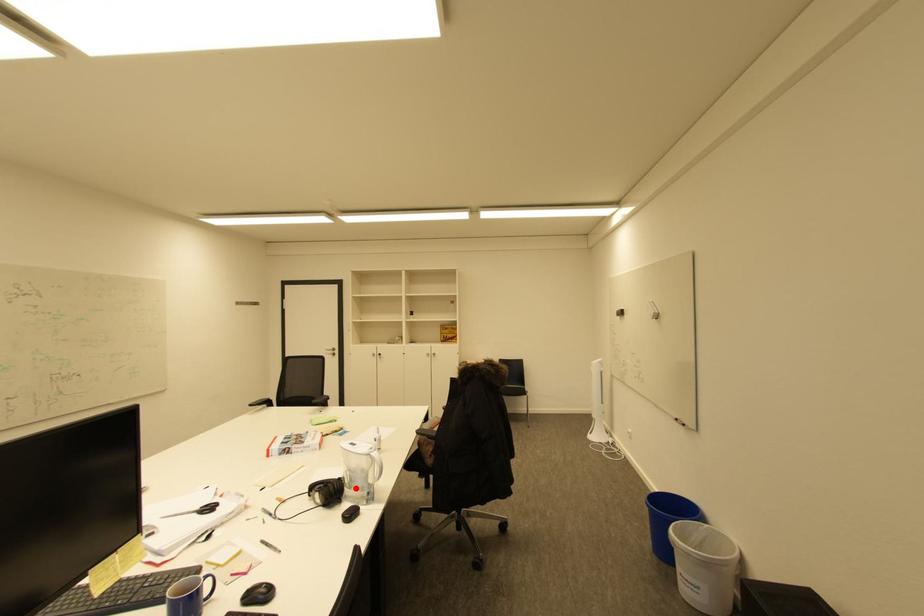
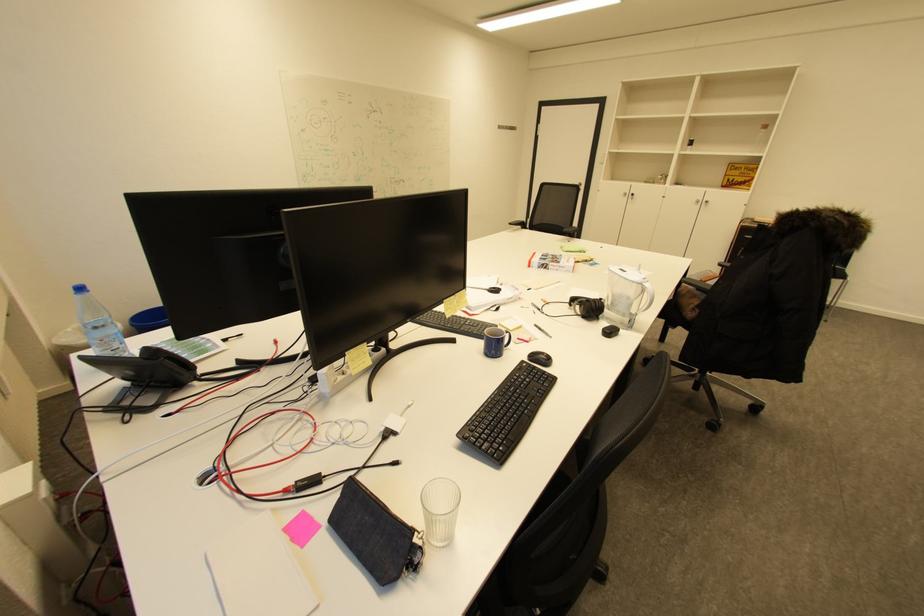
Question: I am providing you with two images of the same scene from different viewpoints. Given a red point in image1, look at the same physical point in image2. Is it:

Choices:
 (A) Closer to the viewpoint
 (B) Farther from the viewpoint

Answer: (A)